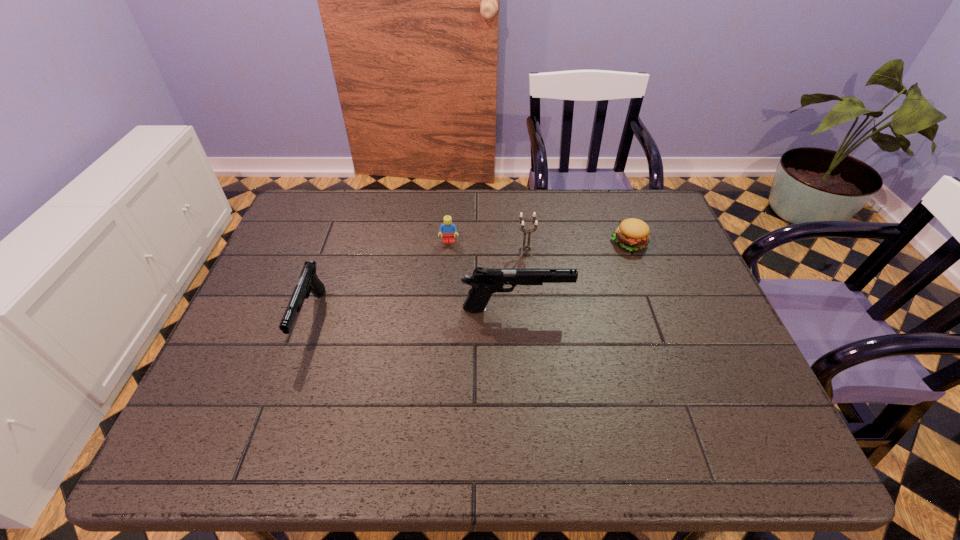
The guns are evenly distributed in the image. To maintain this, where would you place another gun on the right? Please point to a free space. Please provide its 2D coordinates. Your answer should be formatted as a tuple, i.e. [(x, y)], where the tuple contains the x and y coordinates of a point satisfying the conditions above.

[(713, 300)]